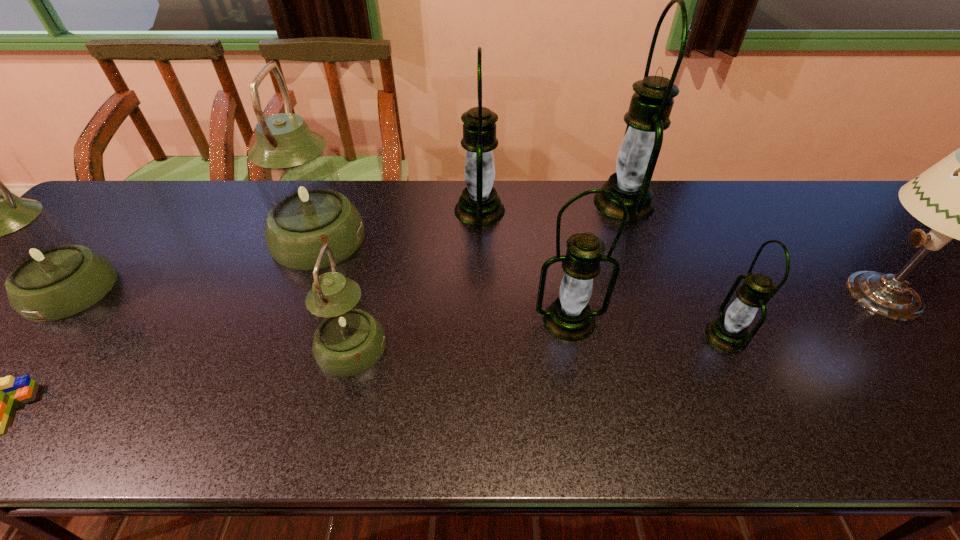
Locate an element on the screen. unoccupied position between the tallest lantern and the lampshade is located at coordinates (753, 248).

You are a GUI agent. You are given a task and a screenshot of the screen. Output one action in this format:
    pyautogui.click(x=<x>, y=<y>)
    Task: Click on the free space between the lampshade and the tallest object
    The image size is (960, 540).
    Given the screenshot: What is the action you would take?
    pyautogui.click(x=753, y=248)

Where is `vacant region between the tallest object and the smallest green lantern`? vacant region between the tallest object and the smallest green lantern is located at coordinates (675, 269).

Where is `free space between the smallest greenish lantern and the fourth lantern from right to left`? This screenshot has width=960, height=540. free space between the smallest greenish lantern and the fourth lantern from right to left is located at coordinates (416, 279).

Identify which object is the second closest to the third biggest green lantern. Please provide its 2D coordinates. Your answer should be formatted as a tuple, i.e. [(x, y)], where the tuple contains the x and y coordinates of a point satisfying the conditions above.

[(479, 205)]

Where is `the third closest object to the biggest green lantern`? This screenshot has width=960, height=540. the third closest object to the biggest green lantern is located at coordinates (729, 332).

Point out which lantern is positioned as the fifth nearest to the smallest greenish lantern. Please provide its 2D coordinates. Your answer should be formatted as a tuple, i.e. [(x, y)], where the tuple contains the x and y coordinates of a point satisfying the conditions above.

[(651, 104)]

Where is `lantern that is the fifth closest to the Lego`? This screenshot has width=960, height=540. lantern that is the fifth closest to the Lego is located at coordinates (570, 318).

Select which green lantern appears as the second closest to the fourth lantern from right to left. Please provide its 2D coordinates. Your answer should be formatted as a tuple, i.e. [(x, y)], where the tuple contains the x and y coordinates of a point satisfying the conditions above.

[(651, 104)]

Choose which green lantern is the nearest neighbor to the third green lantern from right to left. Please provide its 2D coordinates. Your answer should be formatted as a tuple, i.e. [(x, y)], where the tuple contains the x and y coordinates of a point satisfying the conditions above.

[(729, 332)]